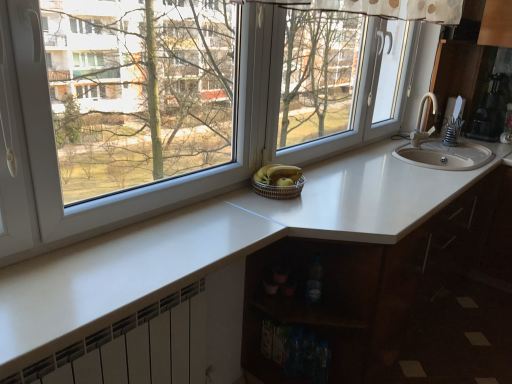
Locate an element on the screen. The image size is (512, 384). space that is in front of woven brown basket at center is located at coordinates (280, 209).